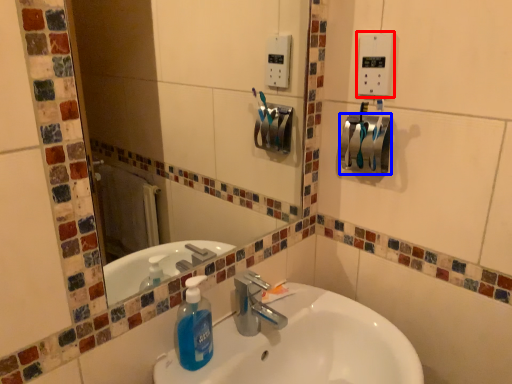
Question: Which point is closer to the camera, light switch (highlighted by a red box) or towel bar (highlighted by a blue box)?

Choices:
 (A) light switch
 (B) towel bar

Answer: (A)